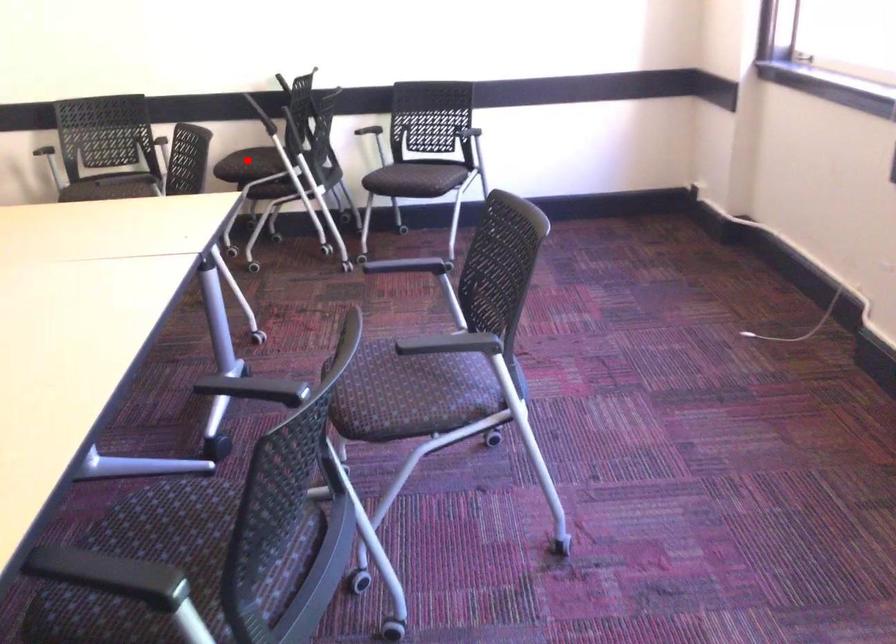
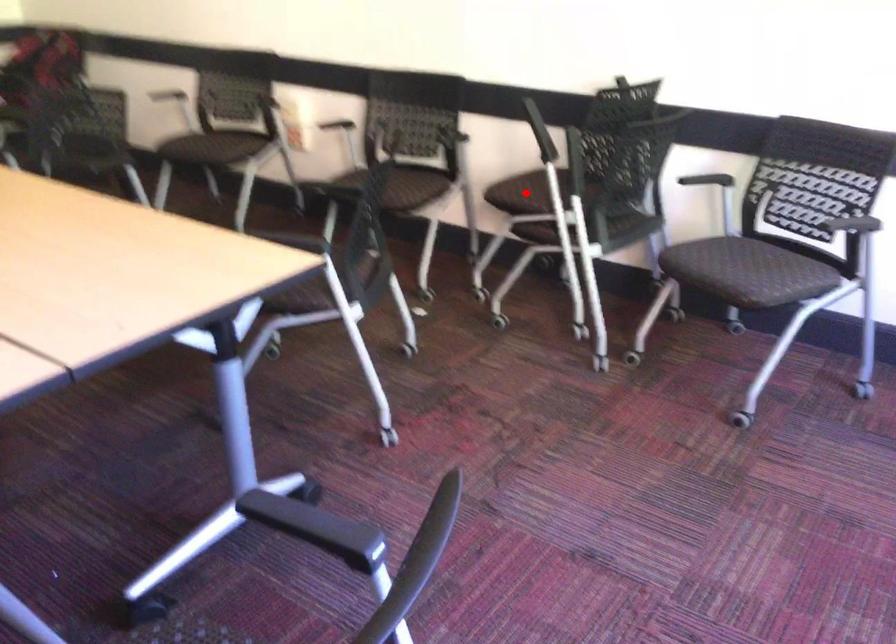
I am providing you with two images of the same scene from different viewpoints. A red point is marked on the first image and another point is marked on the second image. Does the point marked in image1 correspond to the same location as the one in image2?

Yes